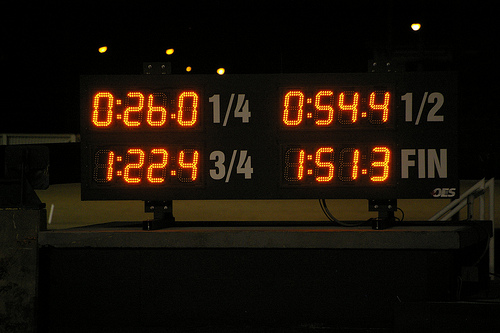
The image size is (500, 333). Find the location of `lights`. lights is located at coordinates (101, 49), (166, 48), (186, 66), (219, 67), (416, 25).